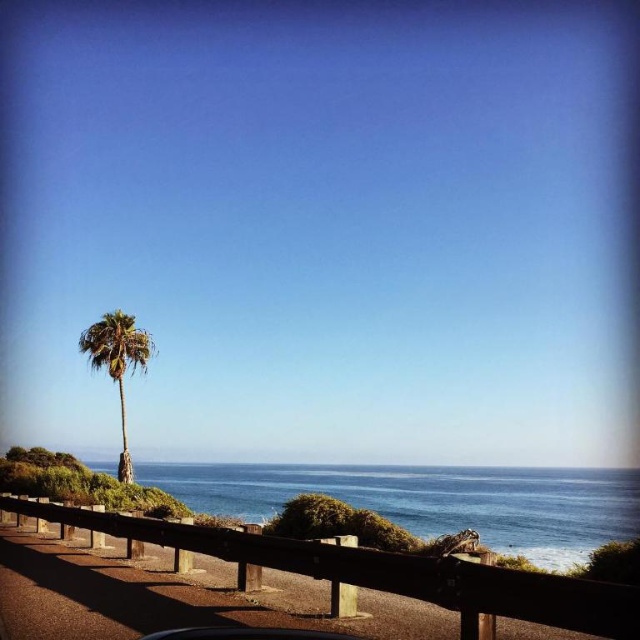
Question: Can you confirm if blue water at center is positioned to the left of green leafy palm tree at left?

Choices:
 (A) yes
 (B) no

Answer: (B)

Question: Is blue water at center below green leafy palm tree at left?

Choices:
 (A) yes
 (B) no

Answer: (A)

Question: Is brown wooden railing at lower center to the right of green leafy palm tree at left from the viewer's perspective?

Choices:
 (A) yes
 (B) no

Answer: (A)

Question: Which object is positioned farthest from the green leafy palm tree at left?

Choices:
 (A) brown wooden railing at lower center
 (B) blue water at center

Answer: (B)

Question: Estimate the real-world distances between objects in this image. Which object is closer to the blue water at center?

Choices:
 (A) green leafy palm tree at left
 (B) brown wooden railing at lower center

Answer: (A)

Question: Which object is positioned closest to the brown wooden railing at lower center?

Choices:
 (A) green leafy palm tree at left
 (B) blue water at center

Answer: (A)